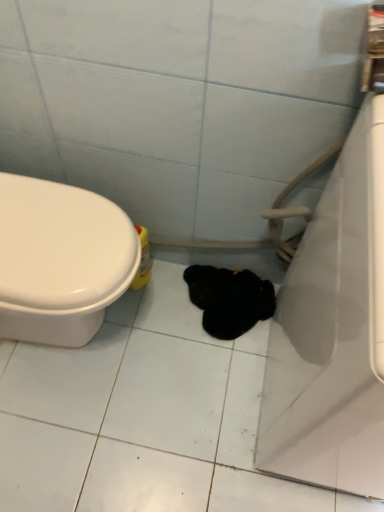
At what (x,y) coordinates should I click in order to perform the action: click on unoccupied region to the right of yellow plastic bottle at lower left. Please return your answer as a coordinate pair (x, y). The width and height of the screenshot is (384, 512). Looking at the image, I should click on (172, 285).